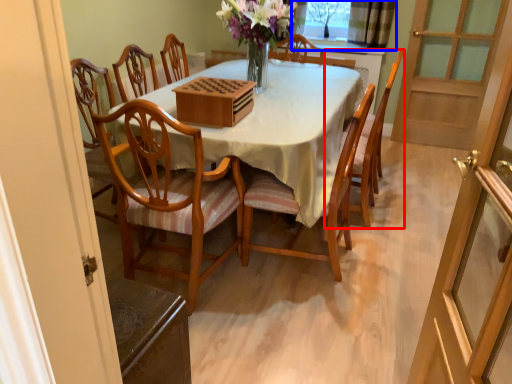
Question: Which point is further to the camera, chair (highlighted by a red box) or window (highlighted by a blue box)?

Choices:
 (A) chair
 (B) window

Answer: (B)